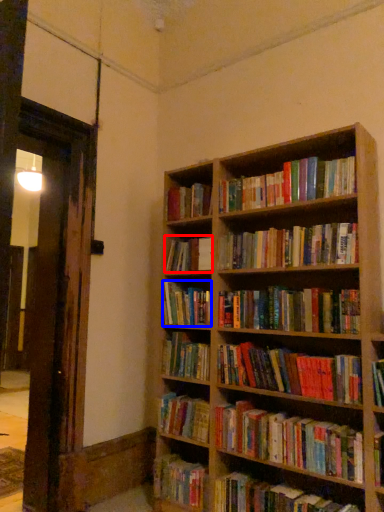
Question: Which object appears closest to the camera in this image, book (highlighted by a red box) or book (highlighted by a blue box)?

Choices:
 (A) book
 (B) book

Answer: (B)